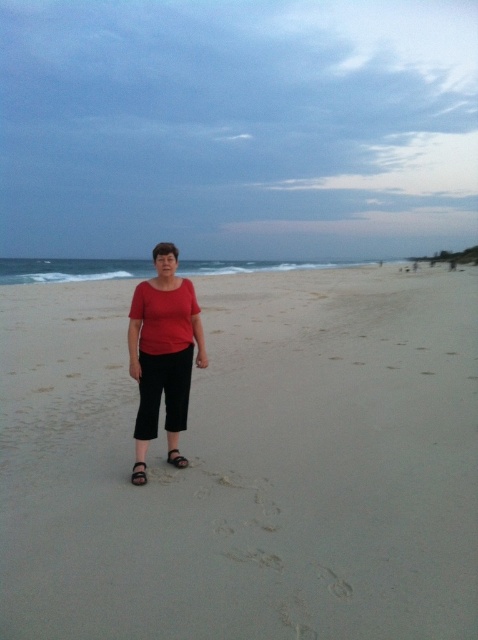
Who is positioned more to the left, sandy at center or black leather sandal at lower center?

Positioned to the left is black leather sandal at lower center.

Is sandy at center closer to the viewer compared to black leather sandal at lower center?

That is True.

Is point (380, 476) in front of point (143, 461)?

No, (380, 476) is behind (143, 461).

Find the location of a particular element. sandy at center is located at coordinates (247, 464).

Between sandy at center and black leather sandal at center, which one has more height?

sandy at center

The width and height of the screenshot is (478, 640). Describe the element at coordinates (247, 464) in the screenshot. I see `sandy at center` at that location.

Identify the location of sandy at center. This screenshot has width=478, height=640. (247, 464).

Between matte red blouse at center and black leather sandal at center, which one has more height?

With more height is matte red blouse at center.

Is matte red blouse at center wider than black leather sandal at center?

Yes, matte red blouse at center is wider than black leather sandal at center.

Identify the location of matte red blouse at center. (162, 348).